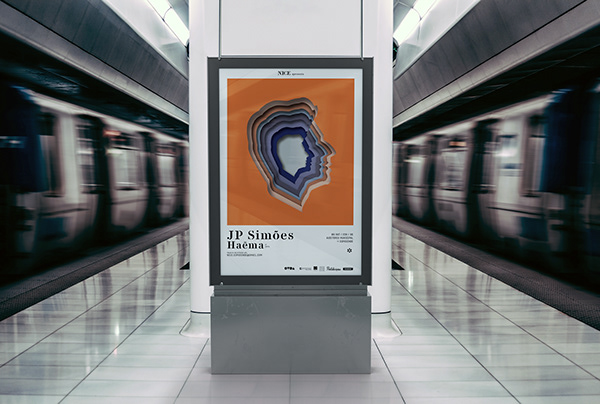
Where is `floor`? This screenshot has width=600, height=404. floor is located at coordinates (458, 365).